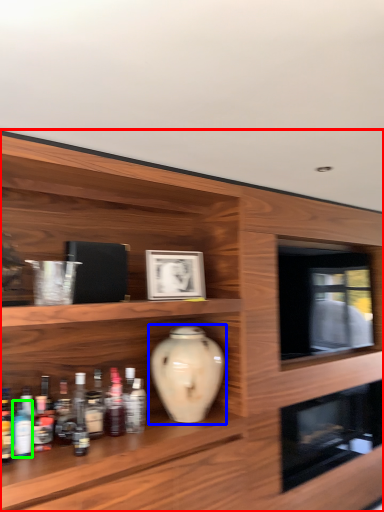
Question: Considering the real-world distances, which object is closest to shelf (highlighted by a red box)? vase (highlighted by a blue box) or bottle (highlighted by a green box).

Choices:
 (A) vase
 (B) bottle

Answer: (A)